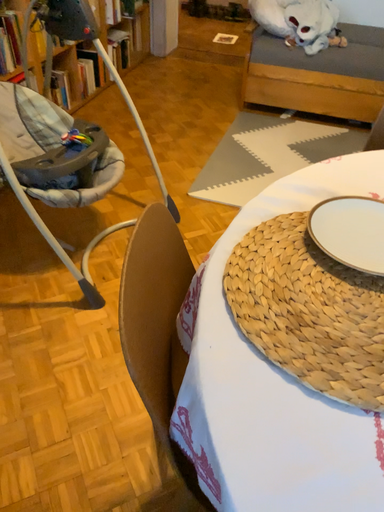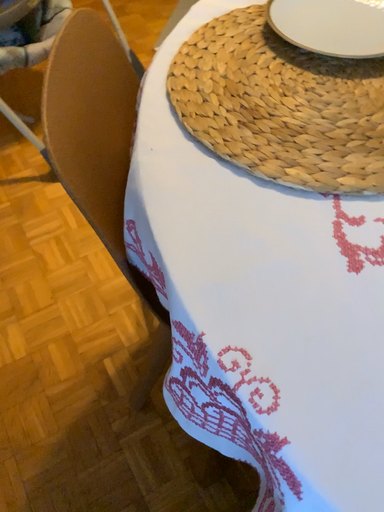
Question: How did the camera likely rotate when shooting the video?

Choices:
 (A) rotated upward
 (B) rotated downward

Answer: (B)